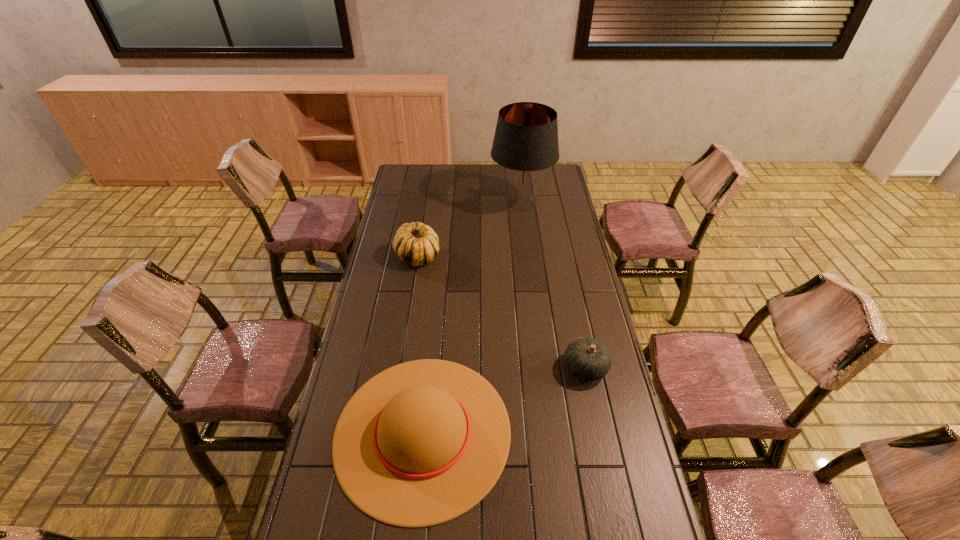
The width and height of the screenshot is (960, 540). I want to click on object that ranks as the third closest to the tallest object, so click(421, 443).